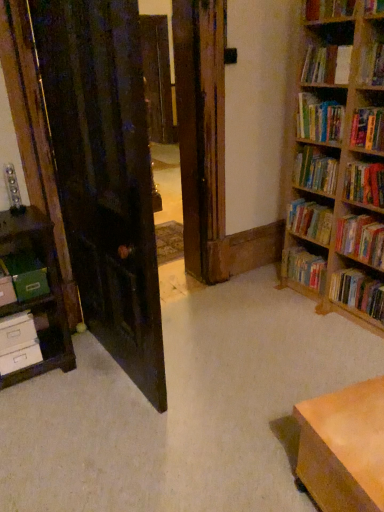
Question: From a real-world perspective, is hardcover books at upper right, the 3th book in the top-to-bottom sequence, located higher than green matte paper at left?

Choices:
 (A) no
 (B) yes

Answer: (B)

Question: Does hardcover books at upper right, acting as the seventh book starting from the bottom, have a greater height compared to green matte paper at left?

Choices:
 (A) no
 (B) yes

Answer: (B)

Question: Is hardcover books at upper right, the 3th book in the top-to-bottom sequence, thinner than green matte paper at left?

Choices:
 (A) no
 (B) yes

Answer: (B)

Question: Can you confirm if hardcover books at upper right, acting as the seventh book starting from the bottom, is positioned to the left of green matte paper at left?

Choices:
 (A) no
 (B) yes

Answer: (A)

Question: Does hardcover books at upper right, acting as the seventh book starting from the bottom, appear on the right side of green matte paper at left?

Choices:
 (A) no
 (B) yes

Answer: (B)

Question: Is hardcover books at right, which ranks as the 4th book in bottom-to-top order, spatially inside hardcover books at upper right, the 3th book in the top-to-bottom sequence, or outside of it?

Choices:
 (A) inside
 (B) outside

Answer: (B)

Question: Does point pos(299,226) appear closer or farther from the camera than point pos(324,133)?

Choices:
 (A) farther
 (B) closer

Answer: (A)

Question: From a real-world perspective, is hardcover books at right, the sixth book in the top-to-bottom sequence, above or below hardcover books at upper right, the 3th book in the top-to-bottom sequence?

Choices:
 (A) below
 (B) above

Answer: (A)

Question: Would you say hardcover books at right, which ranks as the 4th book in bottom-to-top order, is to the left or to the right of hardcover books at upper right, the 3th book in the top-to-bottom sequence, in the picture?

Choices:
 (A) left
 (B) right

Answer: (B)

Question: From a real-world perspective, relative to hardcover books at upper right, the 3th book in the top-to-bottom sequence, is hardcover book at upper right, the 8th book when ordered from bottom to top, vertically above or below?

Choices:
 (A) below
 (B) above

Answer: (B)

Question: In terms of height, does hardcover book at upper right, positioned as the second book in top-to-bottom order, look taller or shorter compared to hardcover books at upper right, acting as the seventh book starting from the bottom?

Choices:
 (A) tall
 (B) short

Answer: (B)

Question: Would you say hardcover book at upper right, positioned as the second book in top-to-bottom order, is to the left or to the right of hardcover books at upper right, the 3th book in the top-to-bottom sequence, in the picture?

Choices:
 (A) left
 (B) right

Answer: (A)

Question: In the image, is hardcover book at upper right, positioned as the second book in top-to-bottom order, positioned in front of or behind hardcover books at upper right, acting as the seventh book starting from the bottom?

Choices:
 (A) front
 (B) behind

Answer: (A)

Question: In the image, is hardcover book at upper right, the 8th book when ordered from bottom to top, positioned in front of or behind hardcover book at lower right, the eighth book when ordered from top to bottom?

Choices:
 (A) behind
 (B) front

Answer: (B)

Question: Is point (311, 82) closer or farther from the camera than point (314, 260)?

Choices:
 (A) farther
 (B) closer

Answer: (B)